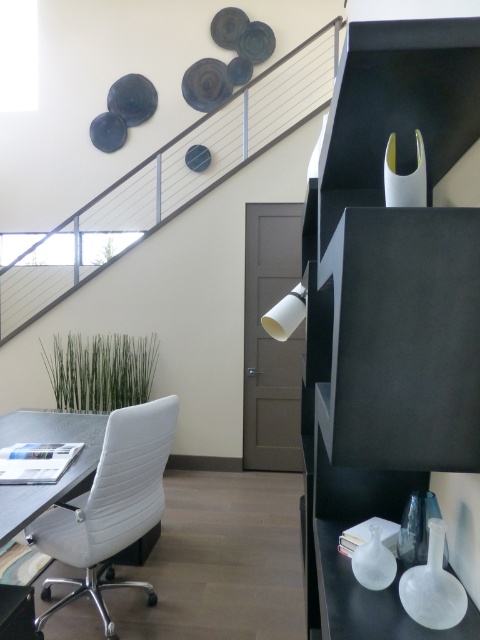
Based on the photo, between metallic staircase at upper center and white leather chair at lower left, which one has less height?

white leather chair at lower left

Which is below, metallic staircase at upper center or white leather chair at lower left?

white leather chair at lower left is lower down.

Find the location of `metallic staircase at upper center`. metallic staircase at upper center is located at coordinates (170, 179).

The height and width of the screenshot is (640, 480). Find the location of `metallic staircase at upper center`. metallic staircase at upper center is located at coordinates (170, 179).